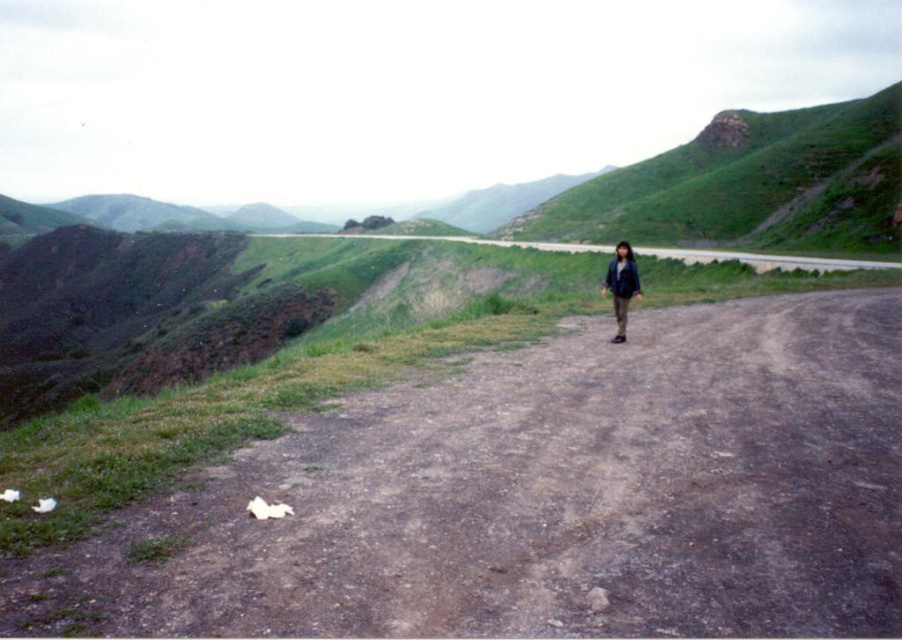
Question: Which point is farther to the camera?

Choices:
 (A) dull brown dirt track at center
 (B) dark blue jacket at center

Answer: (B)

Question: Which point is closer to the camera?

Choices:
 (A) dull brown dirt track at center
 (B) dark blue jacket at center

Answer: (A)

Question: Is dull brown dirt track at center to the left of dark blue jacket at center from the viewer's perspective?

Choices:
 (A) no
 (B) yes

Answer: (B)

Question: Is dull brown dirt track at center wider than dark blue jacket at center?

Choices:
 (A) no
 (B) yes

Answer: (B)

Question: Which object appears closest to the camera in this image?

Choices:
 (A) dull brown dirt track at center
 (B) dark blue jacket at center

Answer: (A)

Question: Is dull brown dirt track at center positioned in front of dark blue jacket at center?

Choices:
 (A) yes
 (B) no

Answer: (A)